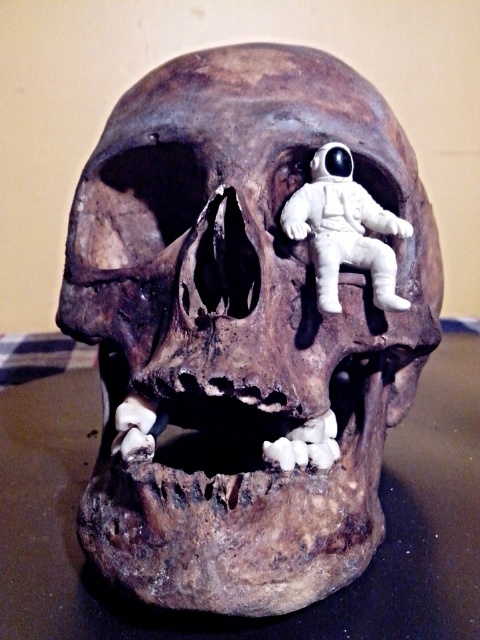
Can you confirm if brown matte skull at center is positioned below white matte astronaut at upper center?

Correct, brown matte skull at center is located below white matte astronaut at upper center.

Is point (117, 554) farther from viewer compared to point (312, 246)?

No.

Describe the element at coordinates (248, 323) in the screenshot. I see `brown matte skull at center` at that location.

You are a GUI agent. You are given a task and a screenshot of the screen. Output one action in this format:
    pyautogui.click(x=<x>, y=<y>)
    Task: Click on the brown matte skull at center
    The height and width of the screenshot is (640, 480).
    Given the screenshot: What is the action you would take?
    pyautogui.click(x=248, y=323)

Looking at this image, can you confirm if black matte skull at center is positioned to the right of white matte astronaut at upper center?

In fact, black matte skull at center is to the left of white matte astronaut at upper center.

Between point (26, 388) and point (314, 269), which one is positioned behind?

Positioned behind is point (26, 388).

Is point (56, 531) behind point (300, 221)?

That is True.

The image size is (480, 640). What are the coordinates of `black matte skull at center` in the screenshot? It's located at (237, 616).

In the scene shown: Is brown matte skull at center closer to camera compared to black matte skull at center?

Yes, it is in front of black matte skull at center.

Can you confirm if brown matte skull at center is wider than black matte skull at center?

No.

What do you see at coordinates (248, 323) in the screenshot?
I see `brown matte skull at center` at bounding box center [248, 323].

I want to click on brown matte skull at center, so click(248, 323).